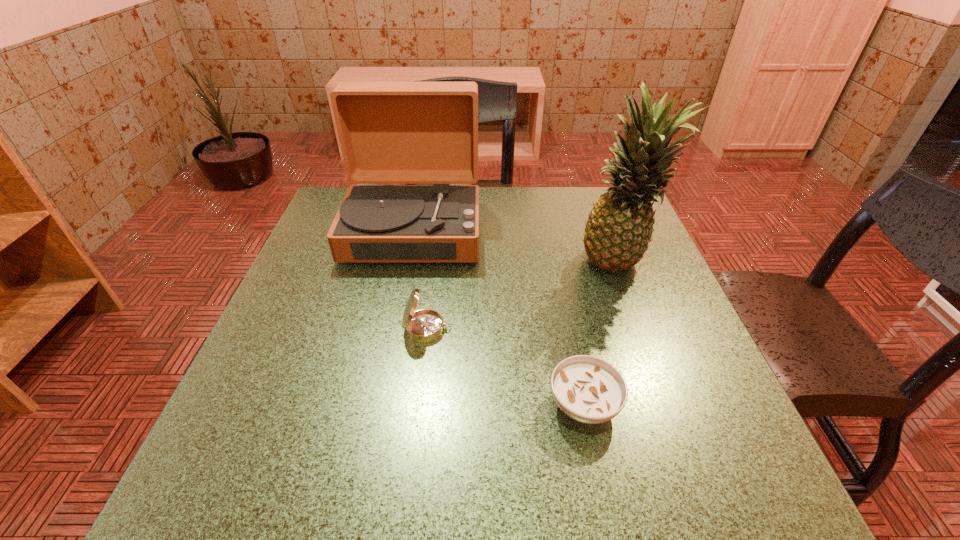
This screenshot has width=960, height=540. I want to click on object present at the far edge, so point(390,132).

You are a GUI agent. You are given a task and a screenshot of the screen. Output one action in this format:
    pyautogui.click(x=<x>, y=<y>)
    Task: Click on the object present at the left edge
    The height and width of the screenshot is (540, 960).
    Given the screenshot: What is the action you would take?
    (390, 132)

The image size is (960, 540). Find the location of `object present at the right edge`. object present at the right edge is located at coordinates (619, 227).

Where is `object located at the far left corner`? This screenshot has height=540, width=960. object located at the far left corner is located at coordinates (390, 132).

Where is `vacant space at the far edge`? The height and width of the screenshot is (540, 960). vacant space at the far edge is located at coordinates (520, 202).

At what (x,y) coordinates should I click in order to perform the action: click on vacant space at the near edge. Please return your answer as a coordinate pair (x, y). Looking at the image, I should click on (637, 499).

Where is `vacant area at the left edge of the desktop`? The width and height of the screenshot is (960, 540). vacant area at the left edge of the desktop is located at coordinates (316, 286).

Where is `blank space at the right edge of the desktop`? The width and height of the screenshot is (960, 540). blank space at the right edge of the desktop is located at coordinates (655, 427).

Locate an element on the screen. This screenshot has width=960, height=540. vacant area at the near left corner of the desktop is located at coordinates (266, 470).

Image resolution: width=960 pixels, height=540 pixels. Identify the location of free spot between the tallest object and the third farthest object. (523, 297).